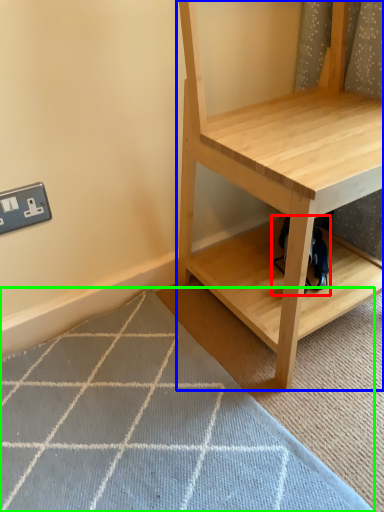
Question: Which object is the farthest from swivel chair (highlighted by a red box)? Choose among these: shelf (highlighted by a blue box) or doormat (highlighted by a green box).

Choices:
 (A) shelf
 (B) doormat

Answer: (B)